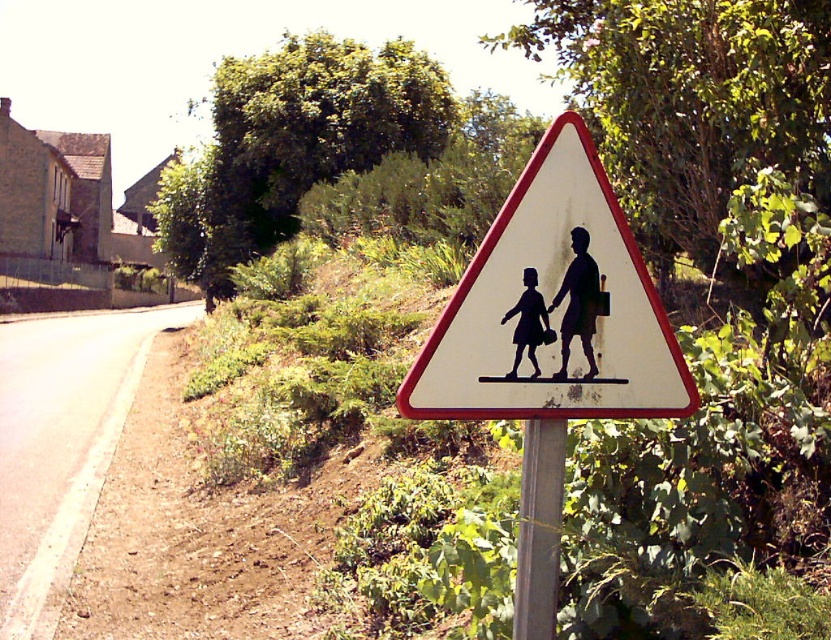
You are a pedestrian approaching the road sign in the image. You see the white matte triangle at center and the silhouette paper child at center. Which object is positioned lower in the scene?

The white matte triangle at center is positioned below the silhouette paper child at center, so it is lower in the scene.